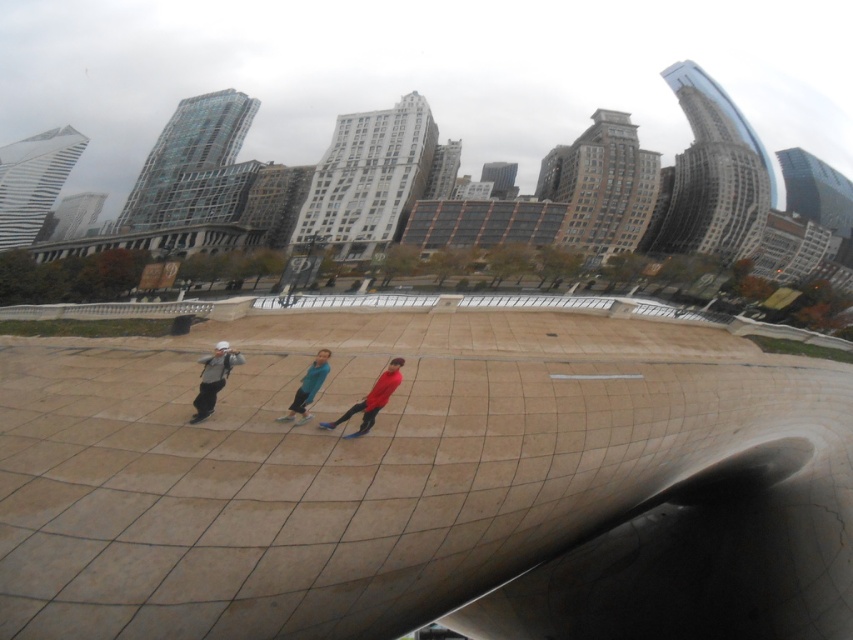
Question: Which is farther from the blue fabric pants at center?

Choices:
 (A) matte red jacket at center
 (B) matte gray jacket at center

Answer: (B)

Question: Is matte gray jacket at center further to the viewer compared to blue fabric pants at center?

Choices:
 (A) no
 (B) yes

Answer: (A)

Question: Which of the following is the closest to the observer?

Choices:
 (A) (320, 362)
 (B) (387, 381)
 (C) (213, 392)

Answer: (C)

Question: Is matte gray jacket at center wider than matte red jacket at center?

Choices:
 (A) yes
 (B) no

Answer: (A)

Question: Is matte gray jacket at center smaller than blue fabric pants at center?

Choices:
 (A) no
 (B) yes

Answer: (A)

Question: Which point appears closest to the camera in this image?

Choices:
 (A) (202, 381)
 (B) (296, 403)
 (C) (386, 378)

Answer: (B)